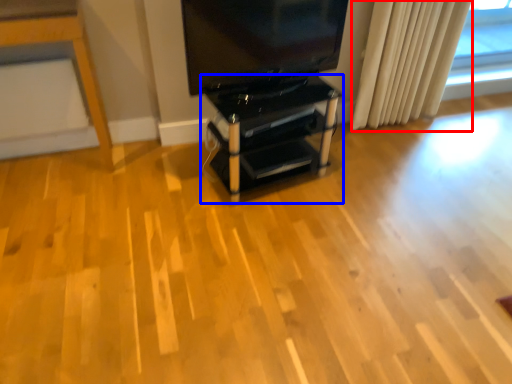
Question: Among these objects, which one is farthest to the camera, curtain (highlighted by a red box) or furniture (highlighted by a blue box)?

Choices:
 (A) curtain
 (B) furniture

Answer: (A)